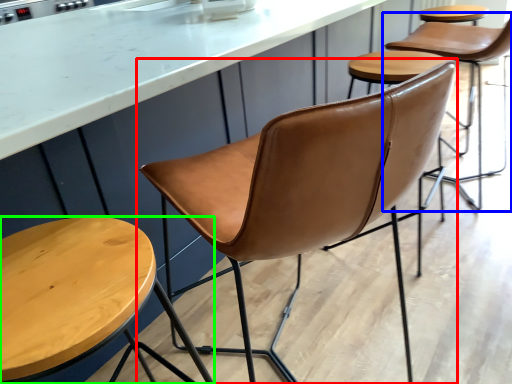
Question: Based on their relative distances, which object is farther from chair (highlighted by a red box)? Choose from chair (highlighted by a blue box) and stool (highlighted by a green box).

Choices:
 (A) chair
 (B) stool

Answer: (A)